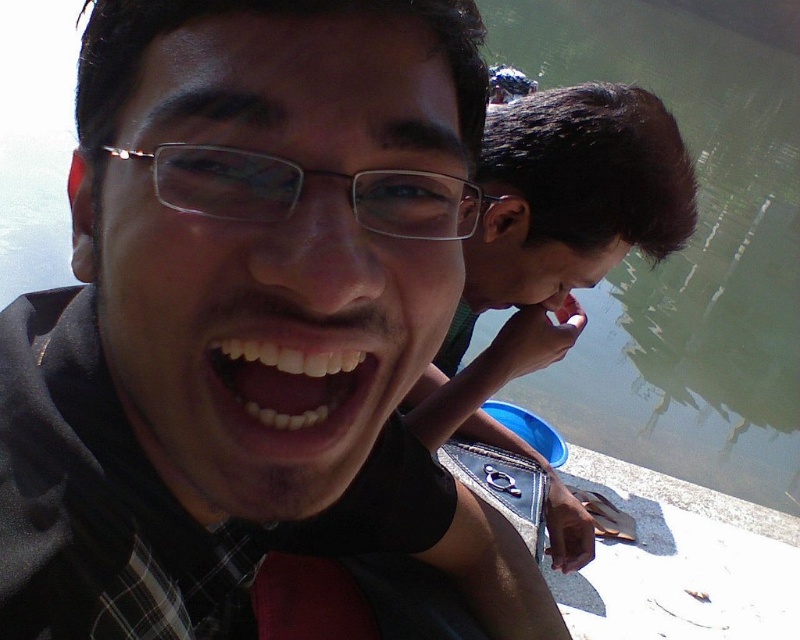
How distant is greenish water at upper right from white glossy teeth at center?

A distance of 14.11 meters exists between greenish water at upper right and white glossy teeth at center.

Which is above, greenish water at upper right or white glossy teeth at center?

greenish water at upper right is higher up.

Which is in front, point (670, 440) or point (350, 384)?

Point (350, 384) is more forward.

The width and height of the screenshot is (800, 640). What are the coordinates of `greenish water at upper right` in the screenshot? It's located at (688, 243).

Is white glossy teeth at center below clear plastic glasses at center?

Yes, white glossy teeth at center is below clear plastic glasses at center.

Is white glossy teeth at center in front of clear plastic glasses at center?

No, white glossy teeth at center is further to the viewer.

Describe the element at coordinates (292, 374) in the screenshot. I see `white glossy teeth at center` at that location.

Find the location of a particular element. The image size is (800, 640). white glossy teeth at center is located at coordinates [292, 374].

Does point (314, 371) lie in front of point (468, 204)?

Yes, it is in front of point (468, 204).

Who is positioned more to the right, matte black jacket at center or clear plastic glasses at center?

clear plastic glasses at center

Does point (176, 545) come closer to viewer compared to point (386, 209)?

No, it is not.

The image size is (800, 640). I want to click on matte black jacket at center, so click(x=248, y=320).